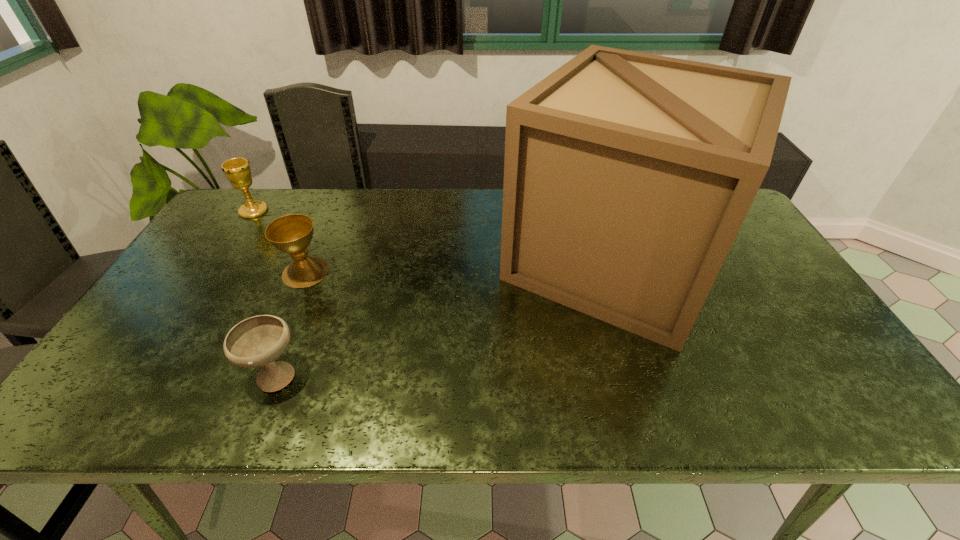
The image size is (960, 540). What are the coordinates of `the tallest object` in the screenshot? It's located at (627, 176).

Where is `box`? box is located at coordinates (627, 176).

Where is `the leftmost chalice`? the leftmost chalice is located at coordinates (237, 170).

This screenshot has width=960, height=540. Identify the location of the leftmost object. (237, 170).

You are a GUI agent. You are given a task and a screenshot of the screen. Output one action in this format:
    pyautogui.click(x=<x>, y=<y>)
    Task: Click on the second farthest chalice
    This screenshot has width=960, height=540.
    Given the screenshot: What is the action you would take?
    tap(292, 234)

The width and height of the screenshot is (960, 540). I want to click on the shortest object, so pyautogui.click(x=257, y=341).

Where is `the nearest chalice`? This screenshot has height=540, width=960. the nearest chalice is located at coordinates (257, 341).

Locate an element on the screen. The image size is (960, 540). vacant area located on the right of the rightmost object is located at coordinates (746, 260).

Image resolution: width=960 pixels, height=540 pixels. I want to click on vacant area situated on the right of the farthest chalice, so click(x=328, y=211).

Image resolution: width=960 pixels, height=540 pixels. I want to click on blank space located on the front of the second nearest chalice, so click(270, 355).